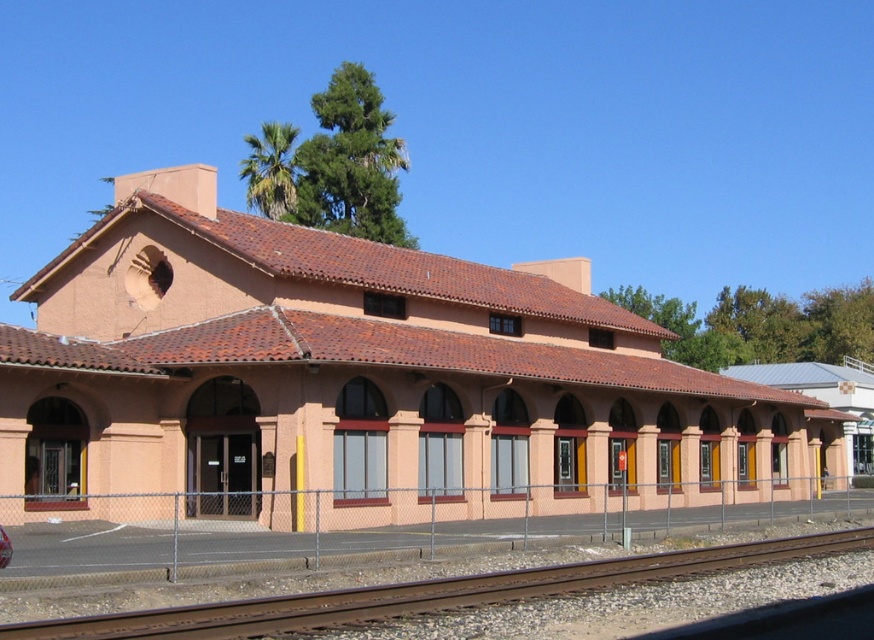
Does point (615, 486) come behind point (720, 548)?

That is True.

Does matte pink building at center have a greater height compared to rusty metal train track at lower left?

Yes, matte pink building at center is taller than rusty metal train track at lower left.

What do you see at coordinates (359, 381) in the screenshot? The image size is (874, 640). I see `matte pink building at center` at bounding box center [359, 381].

Where is `matte pink building at center`? matte pink building at center is located at coordinates (359, 381).